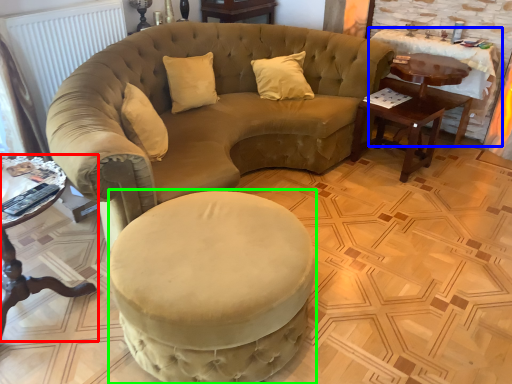
Question: Based on their relative distances, which object is nearer to table (highlighted by a red box)? Choose from table (highlighted by a blue box) and swivel chair (highlighted by a green box).

Choices:
 (A) table
 (B) swivel chair

Answer: (B)